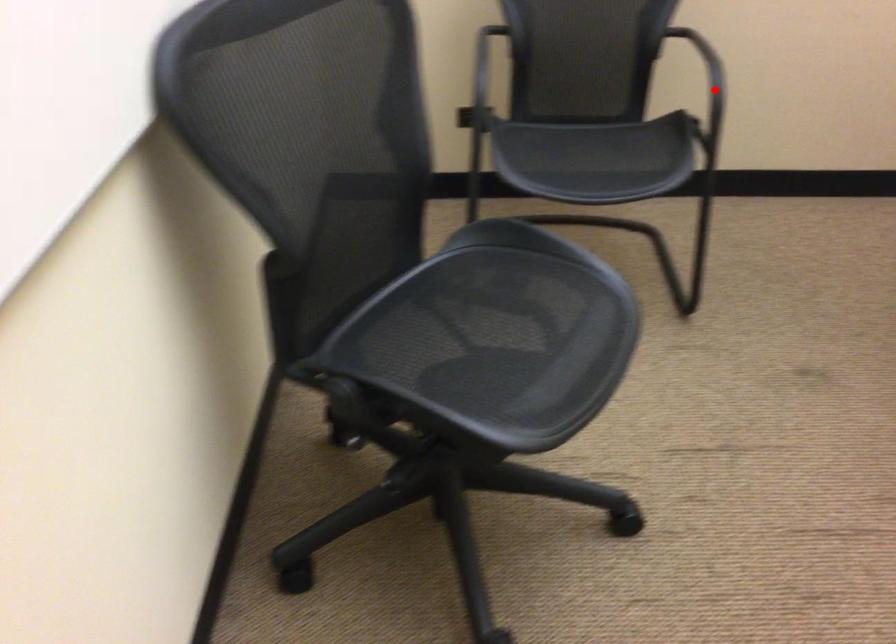
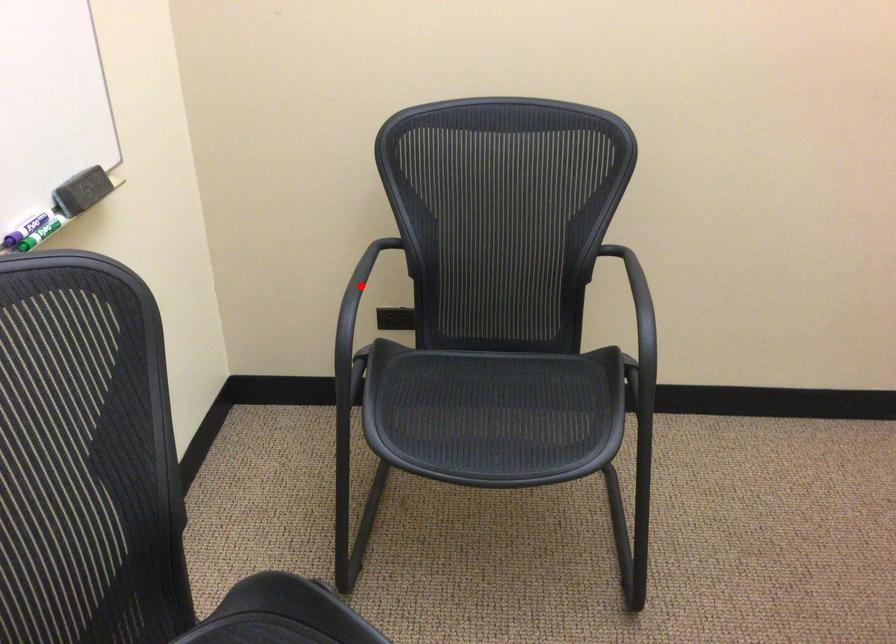
I am providing you with two images of the same scene from different viewpoints. A red point is marked on the first image and another point is marked on the second image. Do the highlighted points in image1 and image2 indicate the same real-world spot?

No